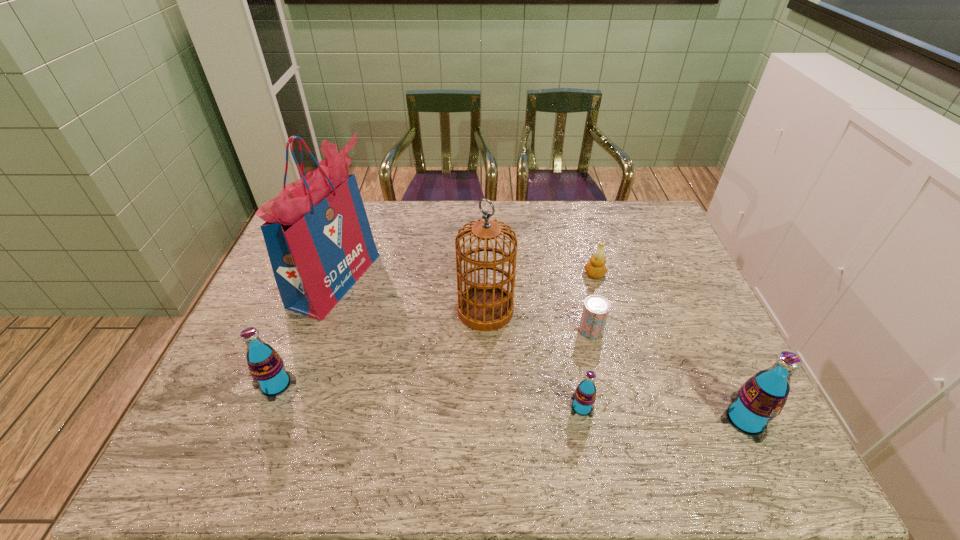
The height and width of the screenshot is (540, 960). What are the coordinates of `empty space that is in between the fourth shortest object and the sixth shortest object` in the screenshot? It's located at (381, 347).

Find the location of a particular element. free point between the birdcage and the grocery bag is located at coordinates (410, 295).

The image size is (960, 540). I want to click on free space that is in between the rightmost soda and the shortest object, so click(668, 375).

Locate an element on the screen. The height and width of the screenshot is (540, 960). empty location between the rightmost object and the shortest object is located at coordinates (668, 375).

In order to click on unoccupied position between the shortest soda and the candle_holder in this screenshot , I will do `click(588, 341)`.

At what (x,y) coordinates should I click in order to perform the action: click on unoccupied area between the sixth shortest object and the candle_holder. Please return your answer as a coordinate pair (x, y). Looking at the image, I should click on (540, 292).

Image resolution: width=960 pixels, height=540 pixels. I want to click on free spot between the leftmost soda and the candle_holder, so click(x=435, y=329).

Where is `object that stands as the sixth closest to the fourth tallest object`? The image size is (960, 540). object that stands as the sixth closest to the fourth tallest object is located at coordinates (761, 398).

Point out which object is positioned as the sixth nearest to the sixth shortest object. Please provide its 2D coordinates. Your answer should be formatted as a tuple, i.e. [(x, y)], where the tuple contains the x and y coordinates of a point satisfying the conditions above.

[(761, 398)]

Point out which soda is positioned as the nearest to the second tallest soda. Please provide its 2D coordinates. Your answer should be formatted as a tuple, i.e. [(x, y)], where the tuple contains the x and y coordinates of a point satisfying the conditions above.

[(584, 397)]